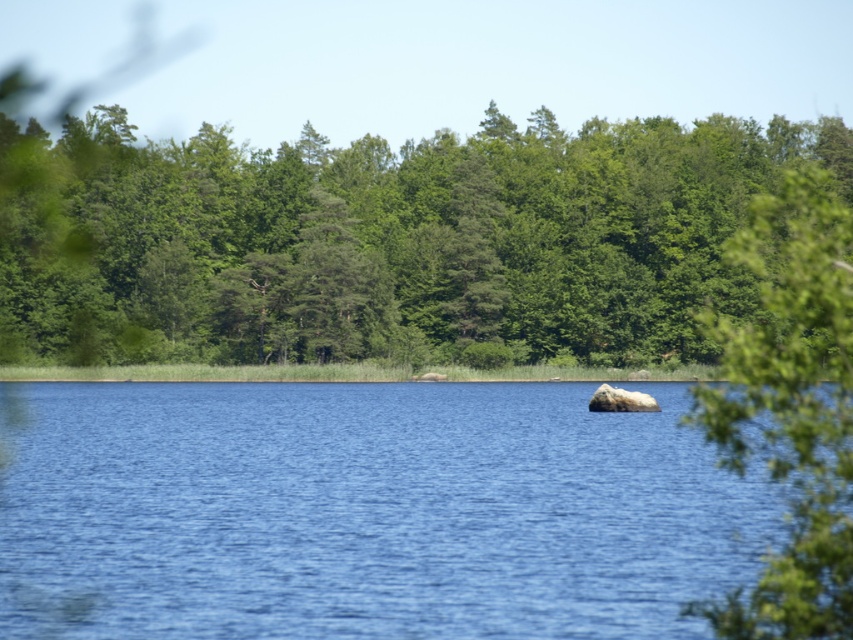
Is green leafy trees at center to the right of green leafy tree at upper right from the viewer's perspective?

No, green leafy trees at center is not to the right of green leafy tree at upper right.

Is green leafy trees at center to the left of green leafy tree at upper right from the viewer's perspective?

Yes, green leafy trees at center is to the left of green leafy tree at upper right.

Between point (498, 122) and point (811, 381), which one is positioned in front?

Point (811, 381) is in front.

Image resolution: width=853 pixels, height=640 pixels. Find the location of `green leafy trees at center`. green leafy trees at center is located at coordinates (384, 240).

Between blue water at center and green leafy tree at upper right, which one has more height?

green leafy tree at upper right is taller.

From the picture: Can you confirm if blue water at center is bigger than green leafy tree at upper right?

Actually, blue water at center might be smaller than green leafy tree at upper right.

Does point (32, 444) lie in front of point (846, 620)?

No, (32, 444) is further to viewer.

Find the location of a particular element. The image size is (853, 640). blue water at center is located at coordinates (364, 513).

The height and width of the screenshot is (640, 853). Describe the element at coordinates (364, 513) in the screenshot. I see `blue water at center` at that location.

Does blue water at center appear over green leafy trees at center?

No, blue water at center is not above green leafy trees at center.

Which is in front, point (286, 388) or point (555, 296)?

Positioned in front is point (286, 388).

I want to click on blue water at center, so (364, 513).